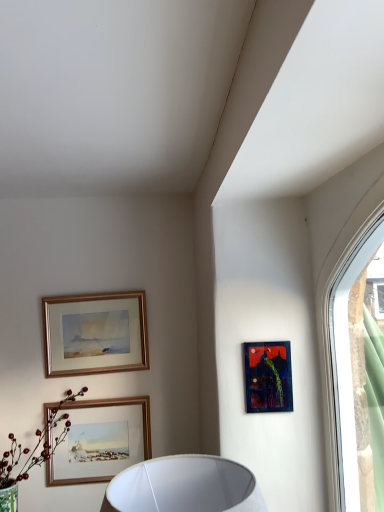
Question: From the image's perspective, relative to green matte flower at lower left, is wooden-framed painting at upper left, which appears as the 1th picture frame when viewed from the back, above or below?

Choices:
 (A) above
 (B) below

Answer: (A)

Question: Relative to green matte flower at lower left, is wooden-framed painting at upper left, which appears as the 1th picture frame when viewed from the back, in front or behind?

Choices:
 (A) behind
 (B) front

Answer: (A)

Question: Estimate the real-world distances between objects in this image. Which object is closer to the clear glass window at upper right?

Choices:
 (A) green matte flower at lower left
 (B) wooden framed picture at lower center, arranged as the first picture frame when ordered from the bottom
 (C) wooden-framed painting at upper left, acting as the third picture frame starting from the right
 (D) dark blue textured painting at upper right, which is counted as the second picture frame, starting from the top

Answer: (D)

Question: Which is nearer to the wooden-framed painting at upper left, which appears as the first picture frame when viewed from the left?

Choices:
 (A) clear glass window at upper right
 (B) wooden framed picture at lower center, acting as the 2th picture frame starting from the left
 (C) green matte flower at lower left
 (D) dark blue textured painting at upper right, which is counted as the second picture frame, starting from the top

Answer: (C)